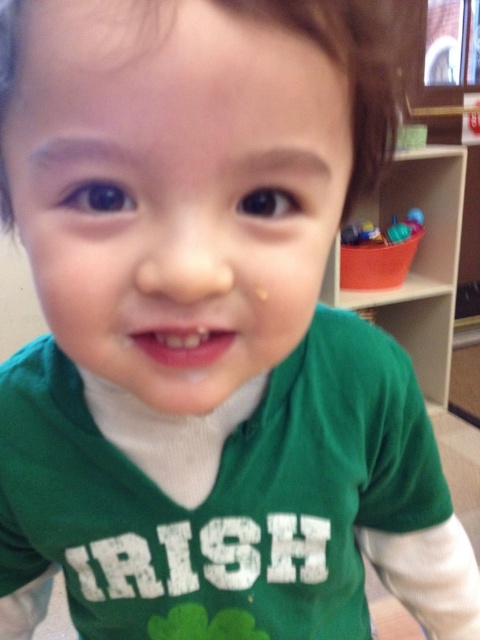
Question: Can you confirm if white wood bookshelf at upper right is positioned to the left of translucent plastic bucket at upper right?

Choices:
 (A) yes
 (B) no

Answer: (B)

Question: Can you confirm if white wood bookshelf at upper right is positioned to the right of translucent plastic bucket at upper right?

Choices:
 (A) yes
 (B) no

Answer: (A)

Question: Does white wood bookshelf at upper right appear over translucent plastic bucket at upper right?

Choices:
 (A) yes
 (B) no

Answer: (B)